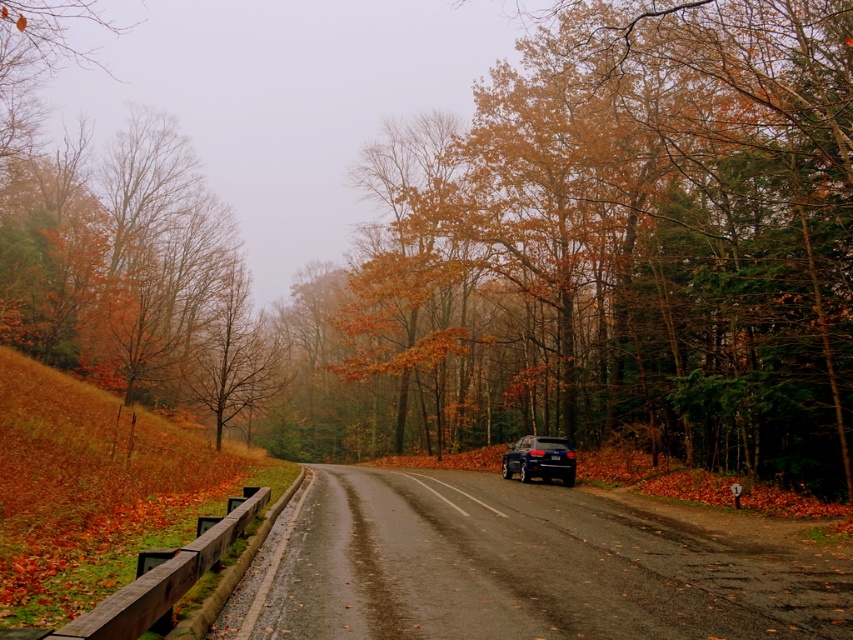
Is orange leafy tree at center thinner than glossy black suv at center?

No.

Does point (412, 243) come closer to viewer compared to point (538, 460)?

No, it is not.

Identify the location of orange leafy tree at center. Image resolution: width=853 pixels, height=640 pixels. [x=642, y=241].